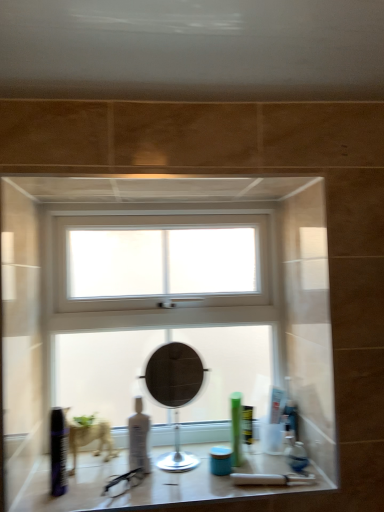
Question: Can you confirm if blue matte jar at center, the third toiletry from the left, is taller than green matte tube at center, the fourth toiletry in the left-to-right sequence?

Choices:
 (A) no
 (B) yes

Answer: (A)

Question: Is green matte tube at center, the first toiletry when ordered from right to left, a part of blue matte jar at center, the third toiletry from the left?

Choices:
 (A) yes
 (B) no

Answer: (B)

Question: Is blue matte jar at center, the third toiletry from the left, facing away from green matte tube at center, the fourth toiletry in the left-to-right sequence?

Choices:
 (A) yes
 (B) no

Answer: (B)

Question: Is the position of blue matte jar at center, the third toiletry from the left, less distant than that of green matte tube at center, the fourth toiletry in the left-to-right sequence?

Choices:
 (A) yes
 (B) no

Answer: (A)

Question: Considering the relative sizes of blue matte jar at center, which is the second toiletry from right to left, and green matte tube at center, the fourth toiletry in the left-to-right sequence, in the image provided, is blue matte jar at center, which is the second toiletry from right to left, smaller than green matte tube at center, the fourth toiletry in the left-to-right sequence,?

Choices:
 (A) yes
 (B) no

Answer: (A)

Question: Is point click(x=59, y=479) closer or farther from the camera than point click(x=215, y=457)?

Choices:
 (A) closer
 (B) farther

Answer: (A)

Question: Would you say shiny black can at lower left, marked as the 4th toiletry in a right-to-left arrangement, is to the left or to the right of blue matte jar at center, the third toiletry from the left, in the picture?

Choices:
 (A) right
 (B) left

Answer: (B)

Question: In the image, is shiny black can at lower left, marked as the 4th toiletry in a right-to-left arrangement, positioned in front of or behind blue matte jar at center, which is the second toiletry from right to left?

Choices:
 (A) front
 (B) behind

Answer: (A)

Question: From their relative heights in the image, would you say shiny black can at lower left, positioned as the first toiletry in left-to-right order, is taller or shorter than blue matte jar at center, which is the second toiletry from right to left?

Choices:
 (A) short
 (B) tall

Answer: (B)

Question: Looking at the image, does matte black mirror at center seem bigger or smaller compared to blue matte jar at center, which is the second toiletry from right to left?

Choices:
 (A) big
 (B) small

Answer: (A)

Question: Considering their positions, is matte black mirror at center located in front of or behind blue matte jar at center, which is the second toiletry from right to left?

Choices:
 (A) front
 (B) behind

Answer: (B)

Question: From the image's perspective, relative to blue matte jar at center, which is the second toiletry from right to left, is matte black mirror at center above or below?

Choices:
 (A) above
 (B) below

Answer: (A)

Question: Does point (160, 389) appear closer or farther from the camera than point (210, 458)?

Choices:
 (A) closer
 (B) farther

Answer: (B)

Question: From the image's perspective, is matte glass counter top at center located above or below blue matte jar at center, the third toiletry from the left?

Choices:
 (A) below
 (B) above

Answer: (A)

Question: Considering the positions of matte glass counter top at center and blue matte jar at center, which is the second toiletry from right to left, in the image, is matte glass counter top at center taller or shorter than blue matte jar at center, which is the second toiletry from right to left,?

Choices:
 (A) short
 (B) tall

Answer: (A)